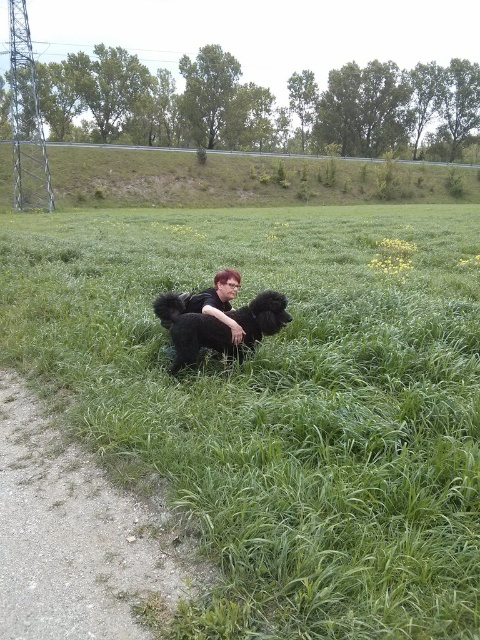
Question: Is black fluffy dog at center wider than shiny black hair at center?

Choices:
 (A) yes
 (B) no

Answer: (A)

Question: Does green grassy field at center have a lesser width compared to shiny black hair at center?

Choices:
 (A) yes
 (B) no

Answer: (B)

Question: Is green grassy field at center to the right of black fluffy dog at center from the viewer's perspective?

Choices:
 (A) yes
 (B) no

Answer: (A)

Question: Which of the following is the closest to the observer?

Choices:
 (A) green grassy field at center
 (B) black fluffy dog at center
 (C) shiny black hair at center

Answer: (A)

Question: Among these points, which one is nearest to the camera?

Choices:
 (A) (284, 301)
 (B) (239, 346)
 (C) (300, 426)

Answer: (C)

Question: Which object is farther from the camera taking this photo?

Choices:
 (A) shiny black hair at center
 (B) green grassy field at center

Answer: (A)